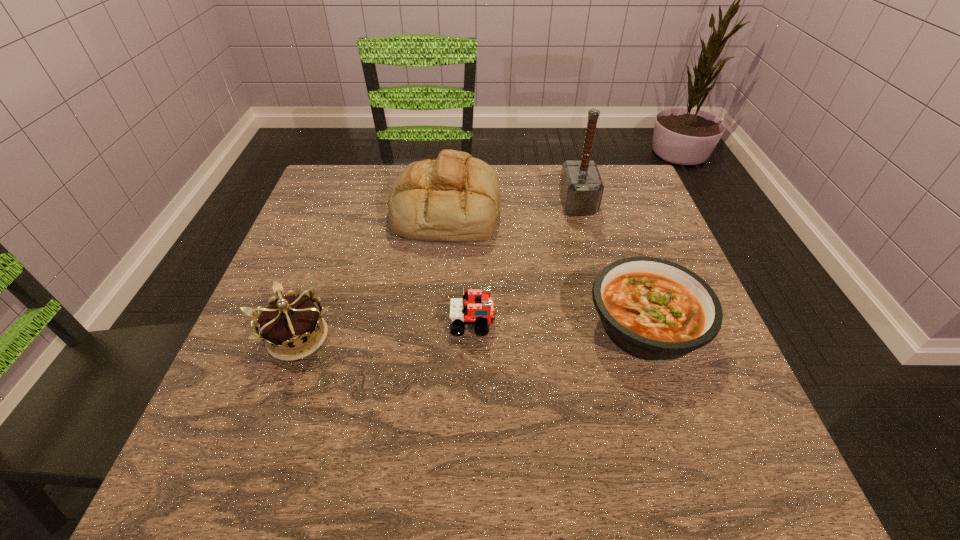
The height and width of the screenshot is (540, 960). Identify the location of free spot located 0.360m on the left of the stew. (401, 326).

Find the location of a particular element. The image size is (960, 540). hammer located at the far edge is located at coordinates (581, 187).

Locate an element on the screen. This screenshot has width=960, height=540. bread present at the far edge is located at coordinates (456, 197).

This screenshot has height=540, width=960. In order to click on object that is at the left edge in this screenshot , I will do `click(289, 326)`.

The height and width of the screenshot is (540, 960). In order to click on hammer located in the right edge section of the desktop in this screenshot , I will do `click(581, 187)`.

Find the location of a particular element. This screenshot has height=540, width=960. stew at the right edge is located at coordinates (656, 310).

You are a GUI agent. You are given a task and a screenshot of the screen. Output one action in this format:
    pyautogui.click(x=<x>, y=<y>)
    Task: Click on the object located at the far right corner
    
    Given the screenshot: What is the action you would take?
    pyautogui.click(x=581, y=187)

Where is `blank space at the far edge`? The width and height of the screenshot is (960, 540). blank space at the far edge is located at coordinates (533, 179).

Find the location of `free space at the near edge of the desktop`. free space at the near edge of the desktop is located at coordinates (449, 450).

In the image, there is a desktop. What are the coordinates of `vacant space at the left edge` in the screenshot? It's located at (328, 237).